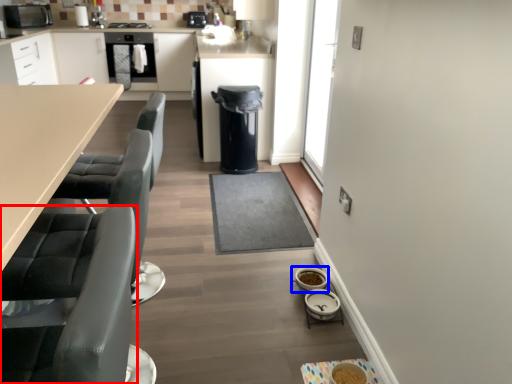
Question: Which point is further to the camera, swivel chair (highlighted by a red box) or appliance (highlighted by a blue box)?

Choices:
 (A) swivel chair
 (B) appliance

Answer: (B)